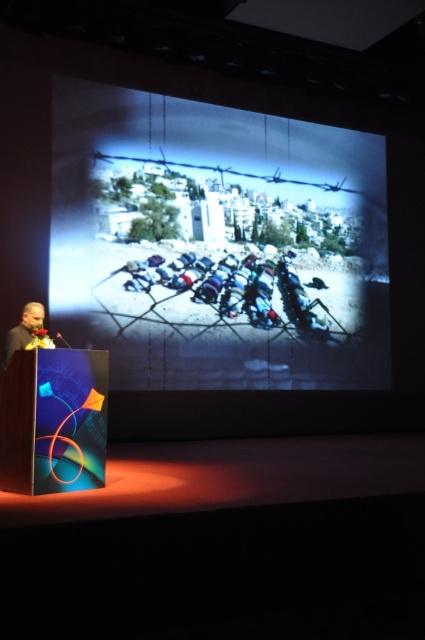
Between point (96, 109) and point (25, 337), which one is positioned behind?

The point (96, 109) is behind.

Can you confirm if matte black screen at center is positioned to the right of black fabric at left?

Yes, matte black screen at center is to the right of black fabric at left.

Image resolution: width=425 pixels, height=640 pixels. What do you see at coordinates (217, 243) in the screenshot? I see `matte black screen at center` at bounding box center [217, 243].

Identify the location of matte black screen at center. The height and width of the screenshot is (640, 425). (217, 243).